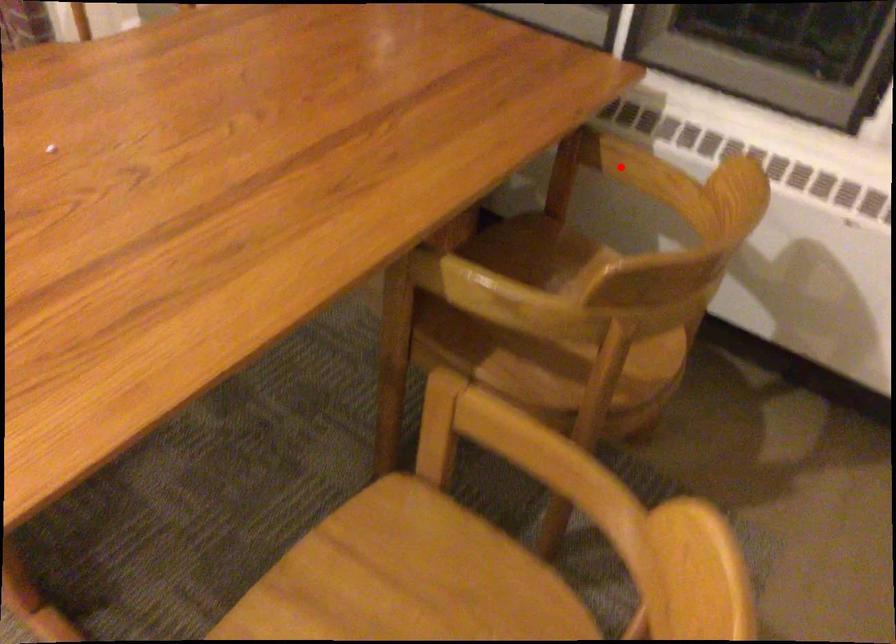
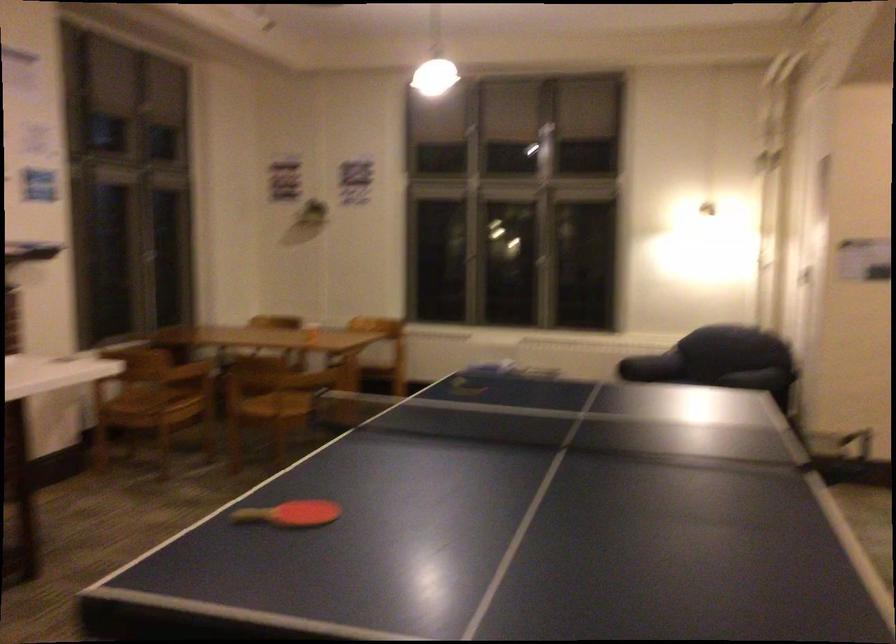
Question: I am providing you with two images of the same scene from different viewpoints. A red point is marked on the first image. Is the red point's position out of view in image 2?

Choices:
 (A) Yes
 (B) No

Answer: (A)